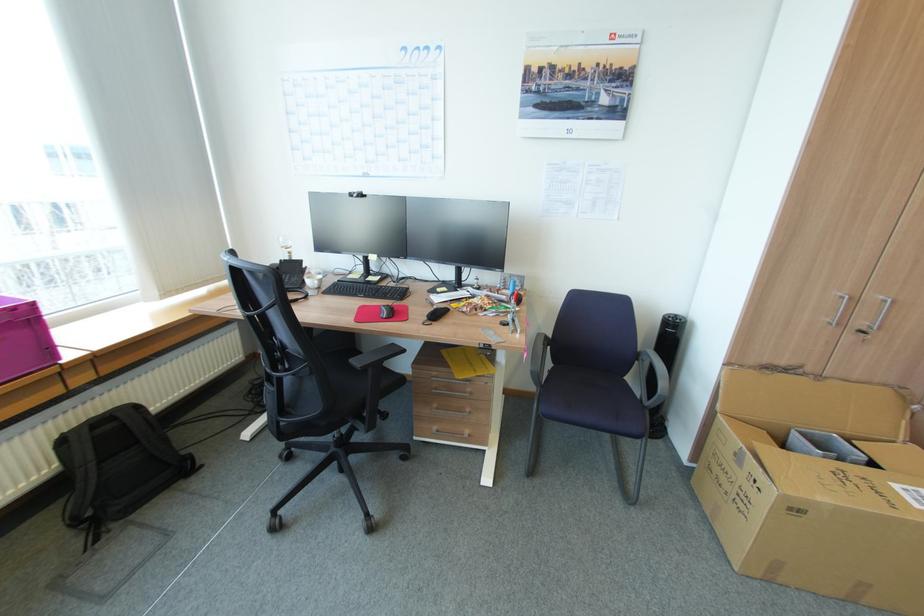
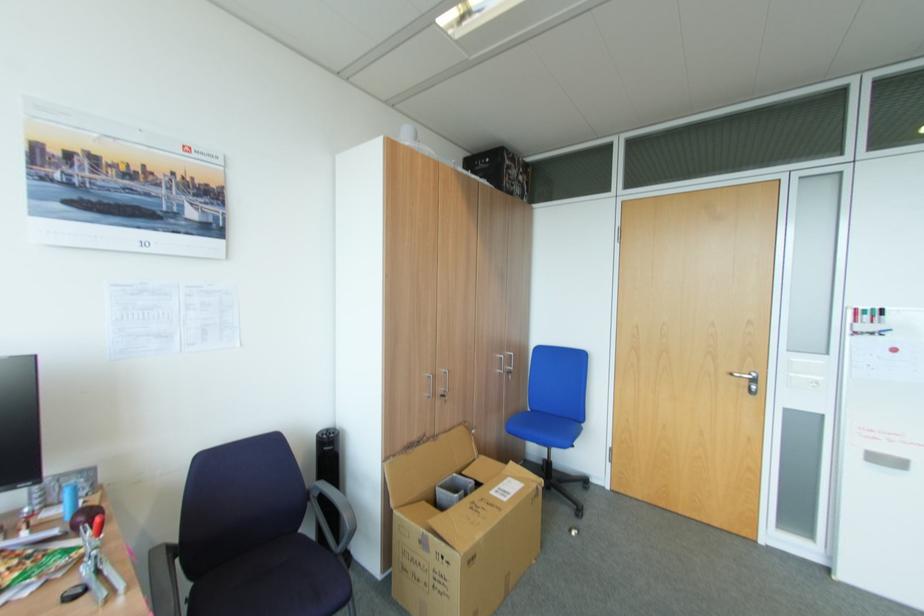
The point at (804, 511) is marked in the first image. Where is the corresponding point in the second image?

(479, 556)